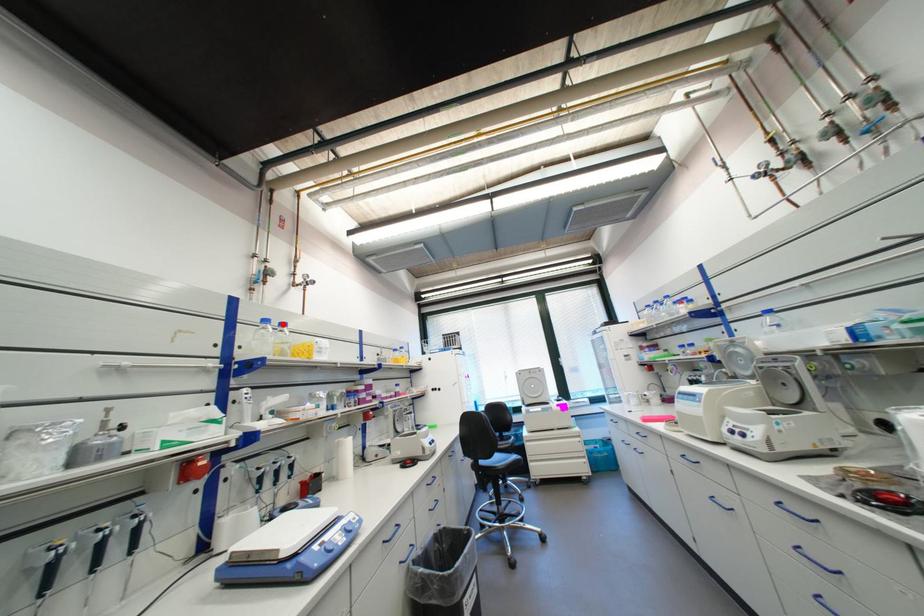
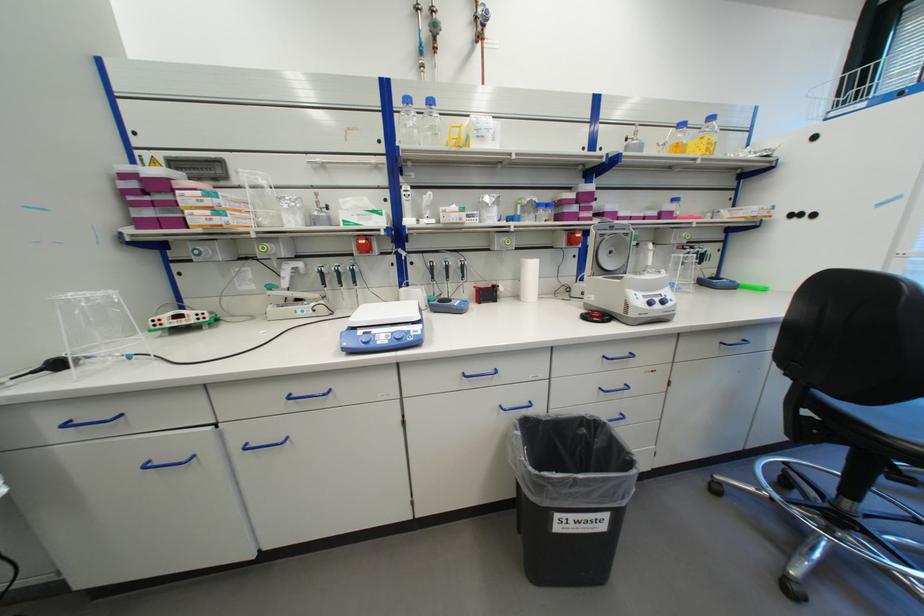
Question: I am providing you with two images of the same scene from different viewpoints. A red point is marked on the first image. Is the red point's position out of view in image 2?

Choices:
 (A) Yes
 (B) No

Answer: (B)